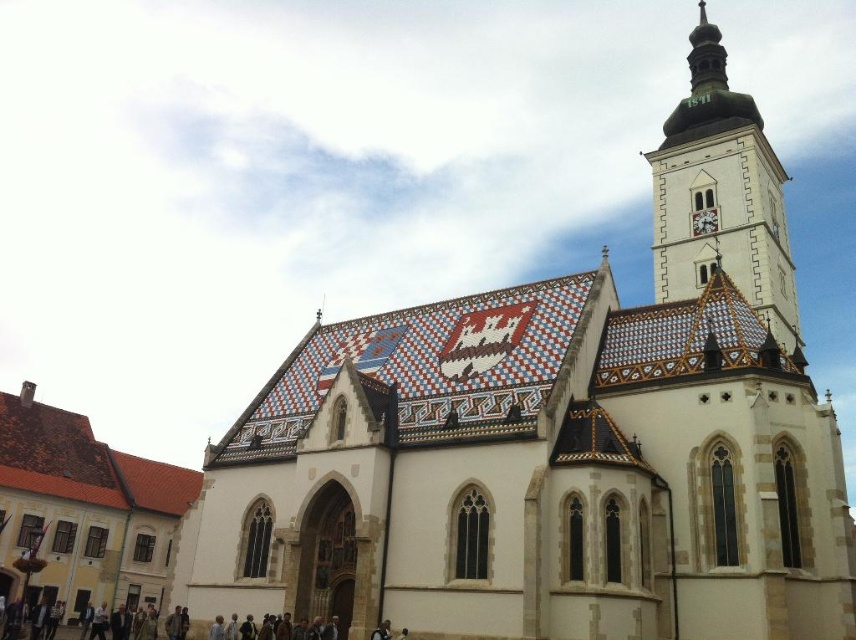
Question: Which point appears farthest from the camera in this image?

Choices:
 (A) (761, 186)
 (B) (694, 234)

Answer: (B)

Question: Does white tiled tower at upper right appear under white textured clock at upper center?

Choices:
 (A) no
 (B) yes

Answer: (A)

Question: Is white tiled tower at upper right further to camera compared to white textured clock at upper center?

Choices:
 (A) yes
 (B) no

Answer: (B)

Question: From the image, what is the correct spatial relationship of white tiled tower at upper right in relation to white textured clock at upper center?

Choices:
 (A) right
 (B) left

Answer: (A)